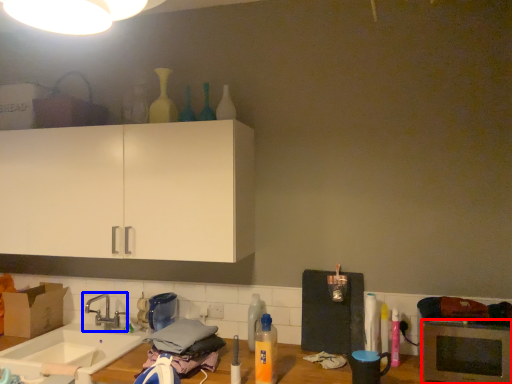
Question: Among these objects, which one is nearest to the camera, microwave oven (highlighted by a red box) or tap (highlighted by a blue box)?

Choices:
 (A) microwave oven
 (B) tap

Answer: (A)